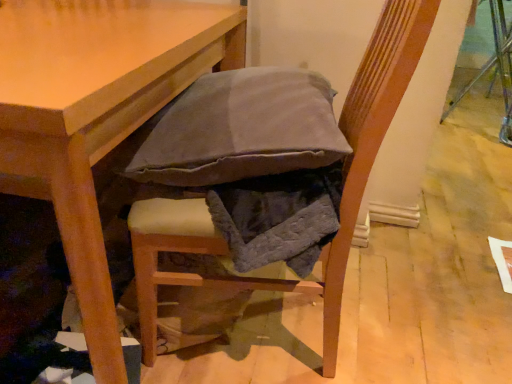
The width and height of the screenshot is (512, 384). I want to click on free point below textured fabric cushion at center (from a real-world perspective), so click(x=289, y=343).